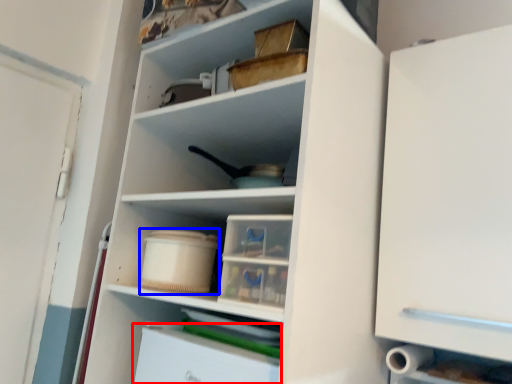
Question: Which object is closer to the camera taking this photo, cabinetry (highlighted by a red box) or storage box (highlighted by a blue box)?

Choices:
 (A) cabinetry
 (B) storage box

Answer: (A)